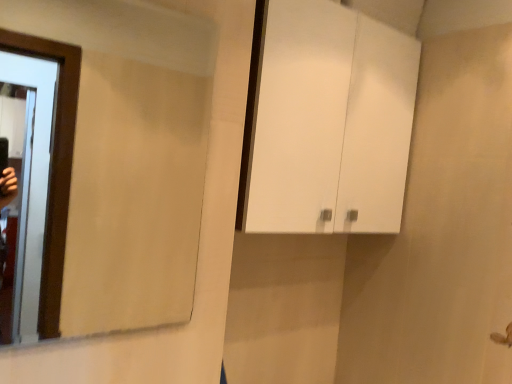
Question: Is clear glass mirror at left bigger or smaller than white glossy cabinet at upper center?

Choices:
 (A) big
 (B) small

Answer: (B)

Question: Relative to white glossy cabinet at upper center, is clear glass mirror at left in front or behind?

Choices:
 (A) front
 (B) behind

Answer: (A)

Question: Which is correct: clear glass mirror at left is inside white glossy cabinet at upper center, or outside of it?

Choices:
 (A) inside
 (B) outside

Answer: (B)

Question: Is white glossy cabinet at upper center inside or outside of clear glass mirror at left?

Choices:
 (A) outside
 (B) inside

Answer: (A)

Question: From the image's perspective, is white glossy cabinet at upper center positioned above or below clear glass mirror at left?

Choices:
 (A) above
 (B) below

Answer: (A)

Question: Considering the positions of white glossy cabinet at upper center and clear glass mirror at left in the image, is white glossy cabinet at upper center bigger or smaller than clear glass mirror at left?

Choices:
 (A) small
 (B) big

Answer: (B)

Question: Is point (298, 107) positioned closer to the camera than point (137, 71)?

Choices:
 (A) farther
 (B) closer

Answer: (B)